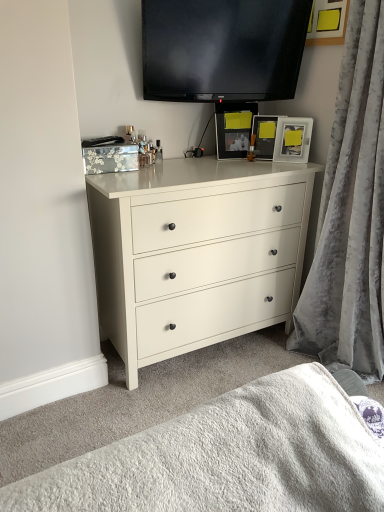
Question: Can you confirm if matte silver picture frame at upper right, the second picture frame from the left, is smaller than white textured blanket at lower center?

Choices:
 (A) yes
 (B) no

Answer: (A)

Question: Is matte silver picture frame at upper right, the second picture frame from the left, oriented away from white textured blanket at lower center?

Choices:
 (A) yes
 (B) no

Answer: (B)

Question: Can you confirm if matte silver picture frame at upper right, the second picture frame from the left, is bigger than white textured blanket at lower center?

Choices:
 (A) no
 (B) yes

Answer: (A)

Question: Is matte silver picture frame at upper right, the first picture frame from the right, in front of white textured blanket at lower center?

Choices:
 (A) yes
 (B) no

Answer: (B)

Question: Are matte silver picture frame at upper right, the second picture frame from the left, and white textured blanket at lower center making contact?

Choices:
 (A) yes
 (B) no

Answer: (B)

Question: Based on their positions, is white matte chest of drawers at center located to the left or right of matte black picture frame at center, which is the second picture frame in right-to-left order?

Choices:
 (A) right
 (B) left

Answer: (B)

Question: From the image's perspective, is white matte chest of drawers at center located above or below matte black picture frame at center, placed as the first picture frame when sorted from left to right?

Choices:
 (A) above
 (B) below

Answer: (B)

Question: Is point (190, 309) positioned closer to the camera than point (273, 128)?

Choices:
 (A) farther
 (B) closer

Answer: (B)

Question: Is white matte chest of drawers at center in front of or behind matte black picture frame at center, which is the second picture frame in right-to-left order, in the image?

Choices:
 (A) behind
 (B) front

Answer: (B)

Question: Is velvet gray curtain at right wider or thinner than white textured blanket at lower center?

Choices:
 (A) thin
 (B) wide

Answer: (A)

Question: Do you think velvet gray curtain at right is within white textured blanket at lower center, or outside of it?

Choices:
 (A) outside
 (B) inside

Answer: (A)

Question: From a real-world perspective, is velvet gray curtain at right physically located above or below white textured blanket at lower center?

Choices:
 (A) below
 (B) above

Answer: (B)

Question: From the image's perspective, is velvet gray curtain at right above or below white textured blanket at lower center?

Choices:
 (A) above
 (B) below

Answer: (A)

Question: Relative to flat screen tv at upper center, is matte silver picture frame at upper right, the second picture frame from the left, in front or behind?

Choices:
 (A) behind
 (B) front

Answer: (A)

Question: Looking at the image, does matte silver picture frame at upper right, the first picture frame from the right, seem bigger or smaller compared to flat screen tv at upper center?

Choices:
 (A) small
 (B) big

Answer: (A)